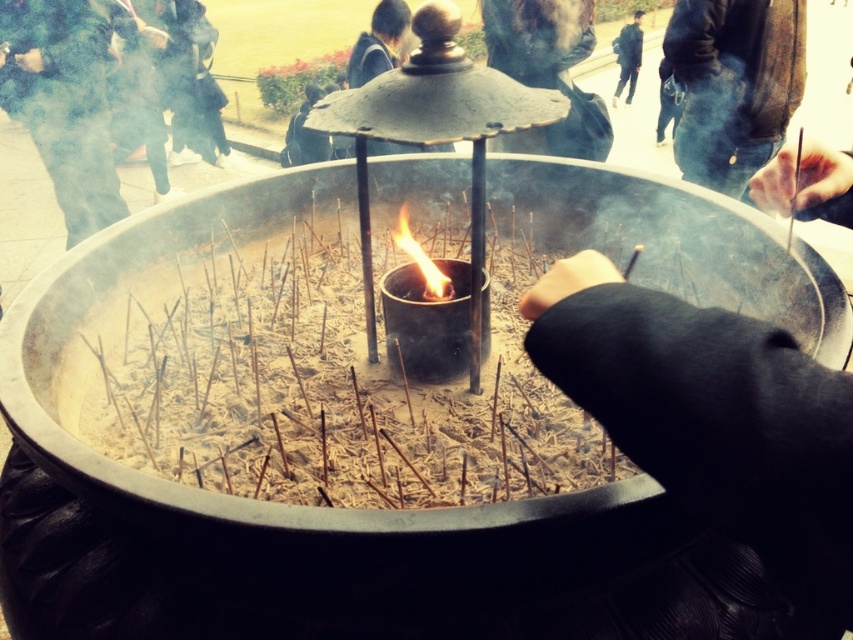
Question: Considering the real-world distances, which object is closest to the flameliquidfire at center?

Choices:
 (A) dark blue jacket at upper center
 (B) smooth skin hand at upper right
 (C) black matte hand at center
 (D) dark brown leather jacket at upper right

Answer: (B)

Question: Considering the real-world distances, which object is closest to the charcoal ash at center?

Choices:
 (A) smooth skin hand at upper right
 (B) dark brown leather jacket at upper right
 (C) green fabric at left

Answer: (A)

Question: Can you confirm if black matte hand at center is positioned above smooth skin hand at upper right?

Choices:
 (A) yes
 (B) no

Answer: (B)

Question: Does dark brown leather jacket at upper center come behind smooth skin hand at upper right?

Choices:
 (A) yes
 (B) no

Answer: (A)

Question: Which of the following is the closest to the observer?

Choices:
 (A) (97, 150)
 (B) (550, 352)
 (C) (560, 134)

Answer: (B)

Question: Can you confirm if black matte hand at center is positioned to the left of dark brown leather jacket at upper right?

Choices:
 (A) no
 (B) yes

Answer: (B)